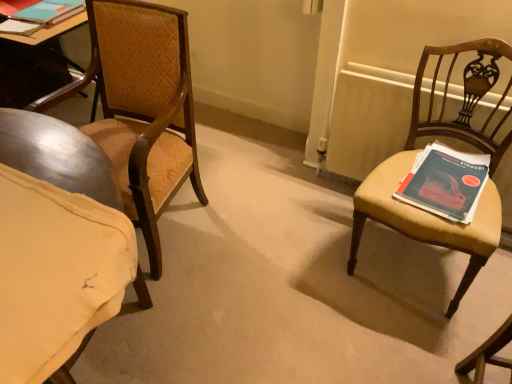
Find the location of a particular element. The height and width of the screenshot is (384, 512). vacant space underneath matte brown chair at right, which is the first chair in right-to-left order (from a real-world perspective) is located at coordinates (404, 265).